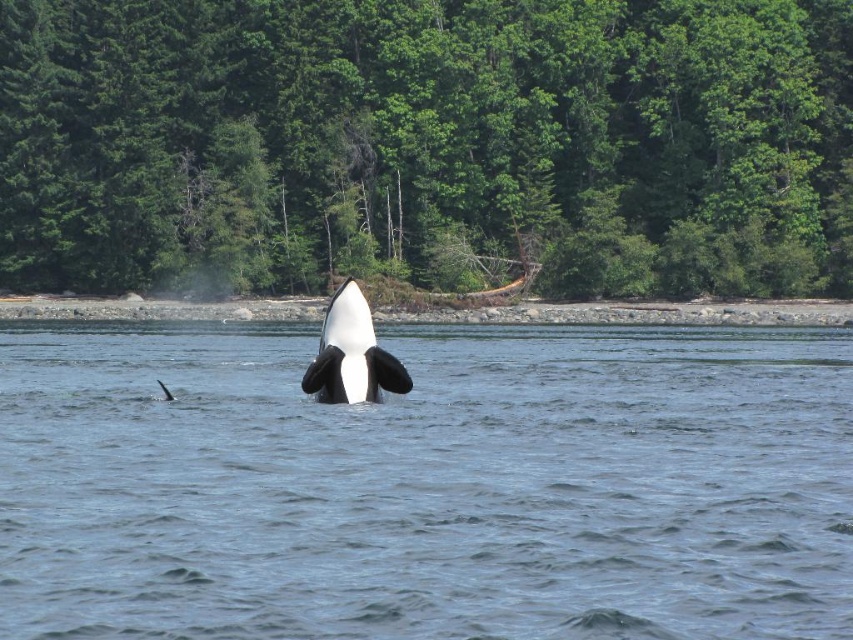
You are a marine biologist observing the orca breaching in the image. You notice a point marked at coordinates (426,484). Based on the scene, what is the location of this point relative to the orca and the surrounding environment?

The point at (426,484) is located on clear blue water at center, which is the area where the orca is breaching the surface. This position is central to the scene and surrounded by the water where the orca is actively moving.

You are a photographer standing on the shore of this coastal area. You want to take a photo that includes both the killer whale breaching the water and the dense forest in the background. Which of the two points, point (x=47, y=637) or point (x=357, y=305), is closer to you as you position yourself to capture this shot?

Point (x=47, y=637) is closer to the viewer than point (x=357, y=305), so you should position yourself closer to that point to ensure both the killer whale and the dense forest are in frame.

You are standing on a boat and want to take a photo of the point at coordinates (334, 410). If your camera has a maximum zoom range of 20 meters, will you be able to capture the point clearly in your photo?

The point at coordinates (334, 410) is 19.27 meters from the camera. Since the camera can zoom up to 20 meters, it is within the maximum range. Therefore, you can capture the point clearly in your photo.